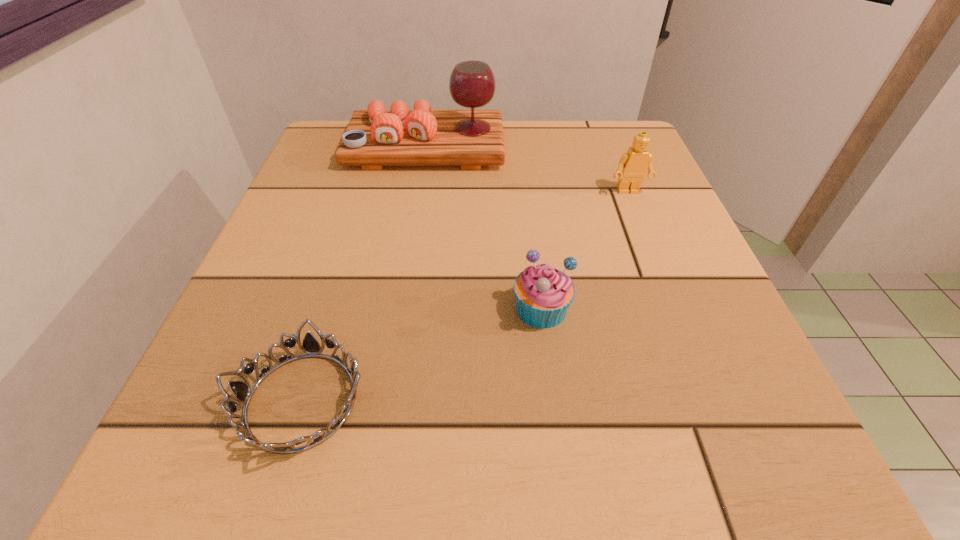
At what (x,y) coordinates should I click in order to perform the action: click on free spot between the shortest object and the second shortest object. Please return your answer as a coordinate pair (x, y). Image resolution: width=960 pixels, height=540 pixels. Looking at the image, I should click on (421, 354).

Image resolution: width=960 pixels, height=540 pixels. I want to click on vacant area that lies between the rightmost object and the tallest object, so click(x=527, y=170).

Locate an element on the screen. unoccupied area between the platter and the rightmost object is located at coordinates (527, 170).

Locate an element on the screen. The width and height of the screenshot is (960, 540). free point between the farthest object and the third farthest object is located at coordinates (484, 228).

Image resolution: width=960 pixels, height=540 pixels. Find the location of `object that is the second closest to the tallest object`. object that is the second closest to the tallest object is located at coordinates (543, 293).

At what (x,y) coordinates should I click in order to perform the action: click on object identified as the third closest to the nearest object. Please return your answer as a coordinate pair (x, y). The width and height of the screenshot is (960, 540). Looking at the image, I should click on (633, 165).

Where is `vacant point that satisfies the following two spatial constraints: 1. on the face of the Lego; 2. on the front-facing side of the shortest object`? vacant point that satisfies the following two spatial constraints: 1. on the face of the Lego; 2. on the front-facing side of the shortest object is located at coordinates (712, 401).

Image resolution: width=960 pixels, height=540 pixels. What are the coordinates of `free region that satisfies the following two spatial constraints: 1. on the face of the rightmost object; 2. on the front-facing side of the shortest object` in the screenshot? It's located at (712, 401).

Locate an element on the screen. The width and height of the screenshot is (960, 540). vacant region that satisfies the following two spatial constraints: 1. on the face of the Lego; 2. on the front-facing side of the nearest object is located at coordinates (712, 401).

This screenshot has width=960, height=540. What are the coordinates of `vacant point that satisfies the following two spatial constraints: 1. on the face of the third shortest object; 2. on the front-facing side of the shortest object` in the screenshot? It's located at (712, 401).